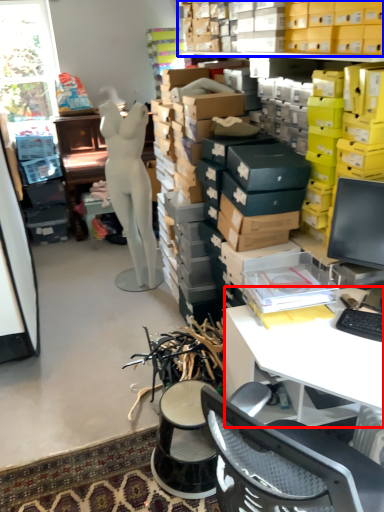
Question: Which point is closer to the camera, desk (highlighted by a red box) or shelf (highlighted by a blue box)?

Choices:
 (A) desk
 (B) shelf

Answer: (A)